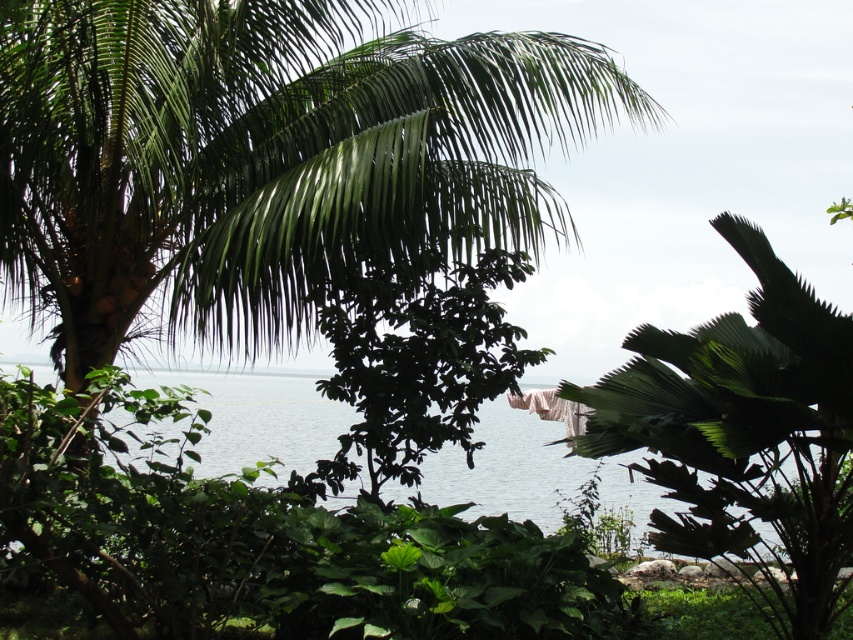
Question: Which object appears farthest from the camera in this image?

Choices:
 (A) green leafy coconut tree at upper left
 (B) clear blue water at center

Answer: (B)

Question: Is green leafy coconut tree at upper left smaller than clear blue water at center?

Choices:
 (A) no
 (B) yes

Answer: (A)

Question: Among these objects, which one is farthest from the camera?

Choices:
 (A) green leafy coconut tree at upper left
 (B) clear blue water at center

Answer: (B)

Question: Can you confirm if green leafy coconut tree at upper left is smaller than clear blue water at center?

Choices:
 (A) yes
 (B) no

Answer: (B)

Question: Does green leafy coconut tree at upper left appear on the right side of clear blue water at center?

Choices:
 (A) yes
 (B) no

Answer: (B)

Question: Which point is farther to the camera?

Choices:
 (A) clear blue water at center
 (B) green leafy coconut tree at upper left

Answer: (A)